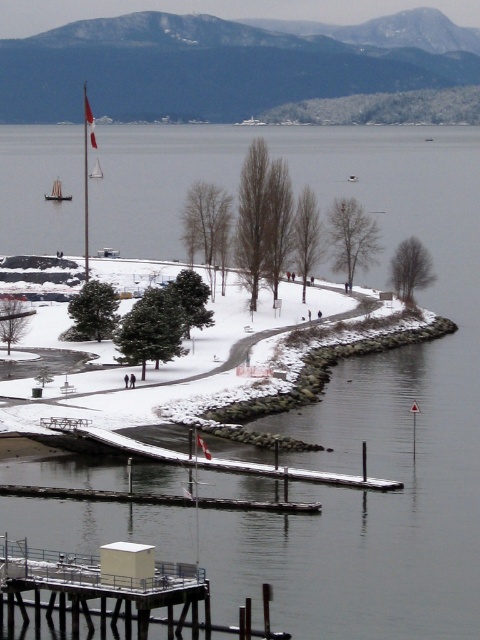
Question: Is wooden sailboat at upper left below white sailboat at upper left?

Choices:
 (A) no
 (B) yes

Answer: (B)

Question: Which is farther from the wooden dock at center?

Choices:
 (A) wooden sailboat at upper left
 (B) white sailboat at upper left

Answer: (B)

Question: Which of the following is the farthest from the observer?

Choices:
 (A) (59, 186)
 (B) (400, 483)
 (C) (96, 163)

Answer: (C)

Question: Among these objects, which one is nearest to the camera?

Choices:
 (A) wooden sailboat at upper left
 (B) white sailboat at upper left
 (C) wooden dock at center

Answer: (C)

Question: Does wooden dock at center appear over white sailboat at upper left?

Choices:
 (A) yes
 (B) no

Answer: (B)

Question: From the image, what is the correct spatial relationship of wooden dock at center in relation to wooden sailboat at upper left?

Choices:
 (A) left
 (B) right

Answer: (B)